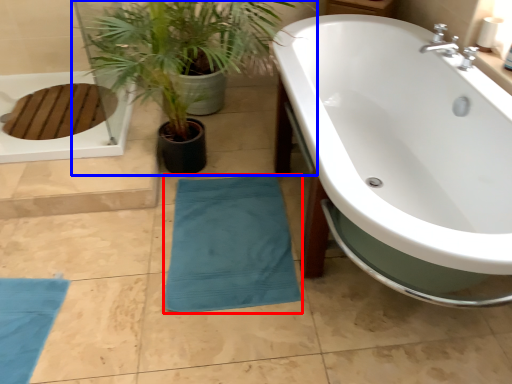
Question: Which of the following is the closest to the observer, beach towel (highlighted by a red box) or houseplant (highlighted by a blue box)?

Choices:
 (A) beach towel
 (B) houseplant

Answer: (B)